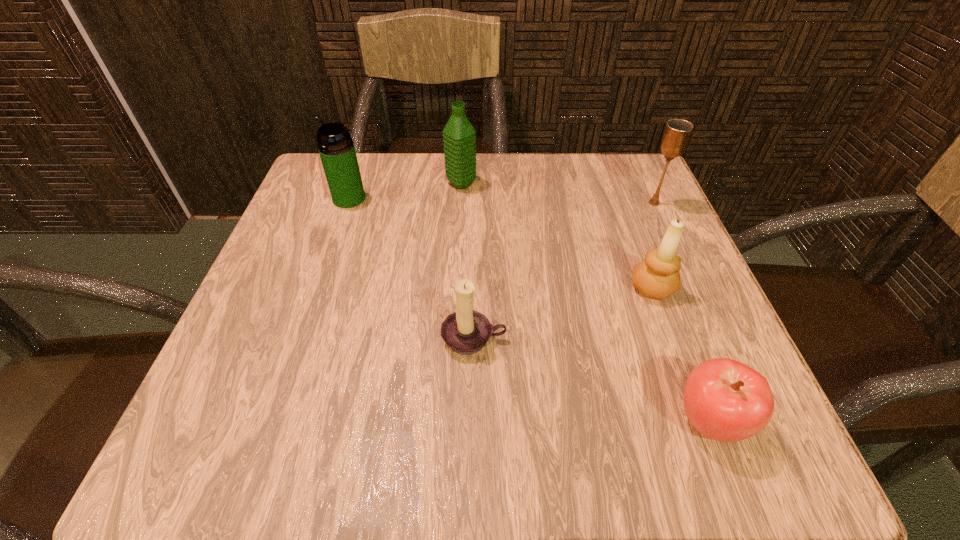
Identify the location of thermos bottle. (336, 148).

The image size is (960, 540). In order to click on water bottle in this screenshot , I will do `click(459, 135)`.

The width and height of the screenshot is (960, 540). Identify the location of chalice. (677, 133).

At what (x,y) coordinates should I click in order to perform the action: click on the right candle holder. Please return your answer as a coordinate pair (x, y). Looking at the image, I should click on (658, 277).

Locate an element on the screen. The width and height of the screenshot is (960, 540). the fourth farthest object is located at coordinates (658, 277).

This screenshot has width=960, height=540. I want to click on the nearer candle holder, so click(x=466, y=331).

You are a GUI agent. You are given a task and a screenshot of the screen. Output one action in this format:
    pyautogui.click(x=<x>, y=<y>)
    Task: Click on the left candle holder
    
    Given the screenshot: What is the action you would take?
    pyautogui.click(x=466, y=331)

Locate an element on the screen. This screenshot has width=960, height=540. the nearest object is located at coordinates (725, 400).

Where is `vacant point located 0.370m on the front of the water bottle`? This screenshot has width=960, height=540. vacant point located 0.370m on the front of the water bottle is located at coordinates (453, 333).

Identify the location of free space located on the front of the chalice. The image size is (960, 540). (665, 229).